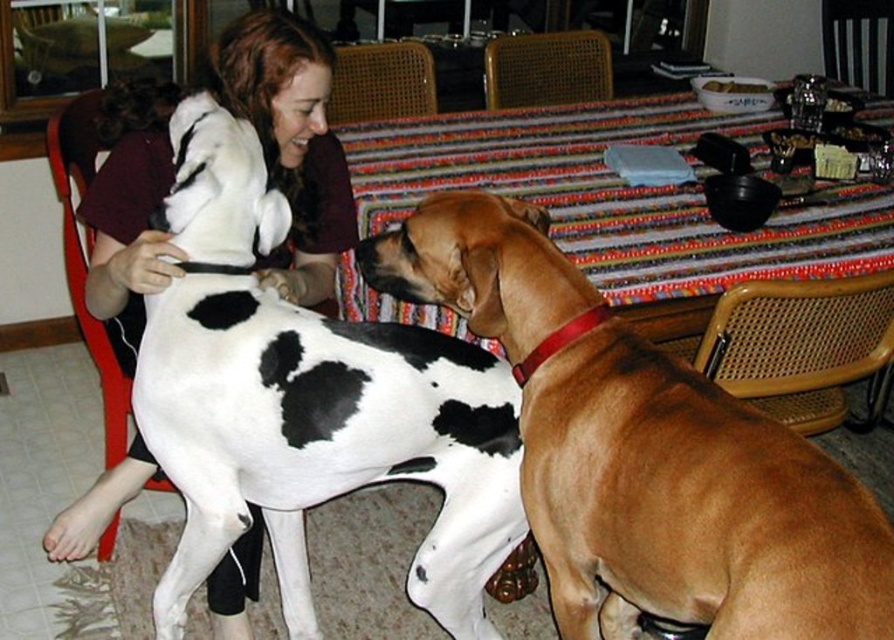
You are a guest at a dinner party and want to sit down. You see the striped fabric table at center and the woven wood chair at upper center. Which object should you approach first to sit?

You should approach the woven wood chair at upper center first because the striped fabric table at center is below it, meaning the chair is positioned above the table and likely closer to where you need to sit.

You are standing at the origin point in the image. There are two points marked in the scene. Which point is closer to you, point [240,253] or point [595,218]?

Point [240,253] is in front of point [595,218], so it is closer to you.